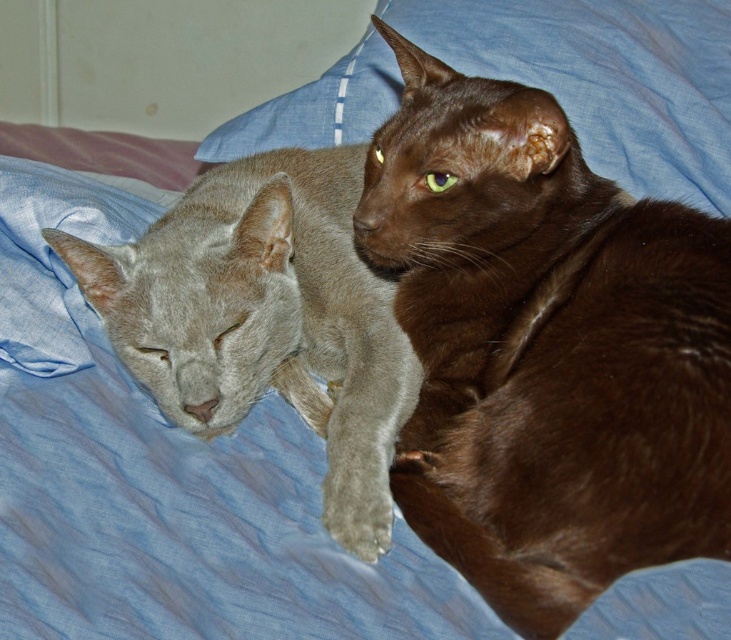
Question: From the image, what is the correct spatial relationship of satin gray cat at left in relation to blue fabric pillow at upper center?

Choices:
 (A) left
 (B) right

Answer: (A)

Question: Among these objects, which one is farthest from the camera?

Choices:
 (A) satin gray cat at left
 (B) blue fabric pillow at upper center
 (C) brown silky cat at upper right

Answer: (B)

Question: Which point is closer to the camera taking this photo?

Choices:
 (A) (232, 156)
 (B) (186, 262)

Answer: (B)

Question: Which point is closer to the camera?

Choices:
 (A) satin gray cat at left
 (B) brown silky cat at upper right

Answer: (B)

Question: Is brown silky cat at upper right further to camera compared to satin gray cat at left?

Choices:
 (A) yes
 (B) no

Answer: (B)

Question: Does brown silky cat at upper right come in front of satin gray cat at left?

Choices:
 (A) yes
 (B) no

Answer: (A)